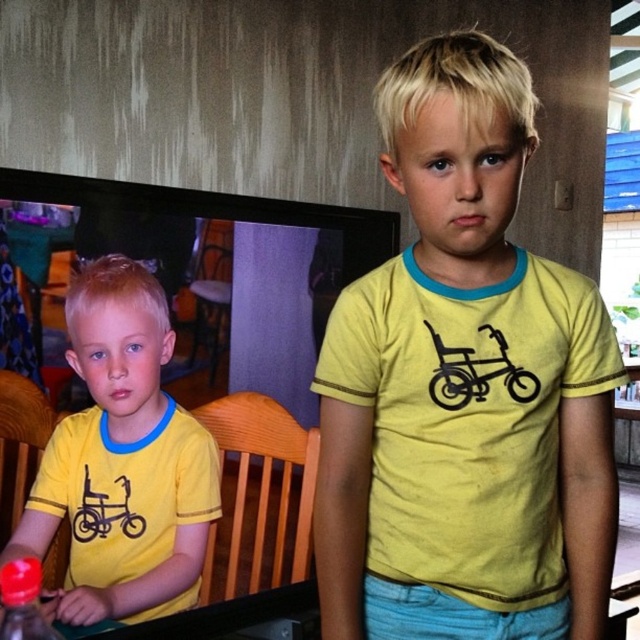
Question: Can you confirm if yellow matte shirt at center is positioned to the left of translucent plastic bottle at lower left?

Choices:
 (A) no
 (B) yes

Answer: (A)

Question: Which object is positioned closest to the translucent plastic bottle at lower left?

Choices:
 (A) matte yellow t-shirt at center
 (B) yellow matte shirt at center

Answer: (A)

Question: Is yellow matte shirt at center to the left of matte yellow t-shirt at center from the viewer's perspective?

Choices:
 (A) yes
 (B) no

Answer: (B)

Question: Estimate the real-world distances between objects in this image. Which object is closer to the matte yellow t-shirt at center?

Choices:
 (A) translucent plastic bottle at lower left
 (B) yellow matte shirt at center

Answer: (A)

Question: Among these objects, which one is farthest from the camera?

Choices:
 (A) yellow matte shirt at center
 (B) matte yellow t-shirt at center

Answer: (B)

Question: Can you confirm if yellow matte shirt at center is positioned below matte yellow t-shirt at center?

Choices:
 (A) yes
 (B) no

Answer: (B)